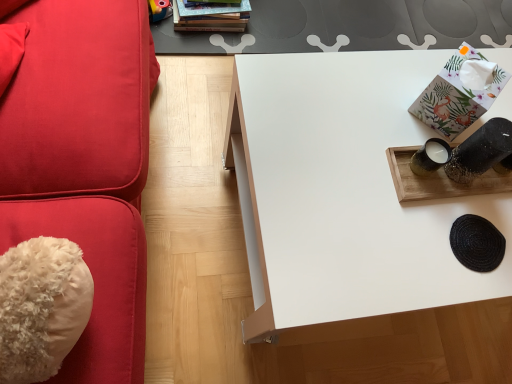
Where is `vacant area that is in front of hardcover books at upper center`? vacant area that is in front of hardcover books at upper center is located at coordinates (189, 35).